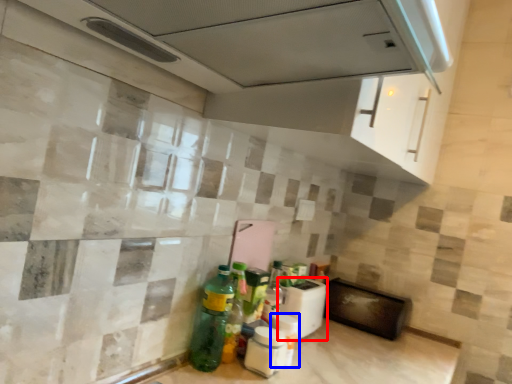
Question: Which object is further to the camera taking this photo, appliance (highlighted by a red box) or bottle (highlighted by a blue box)?

Choices:
 (A) appliance
 (B) bottle

Answer: (A)